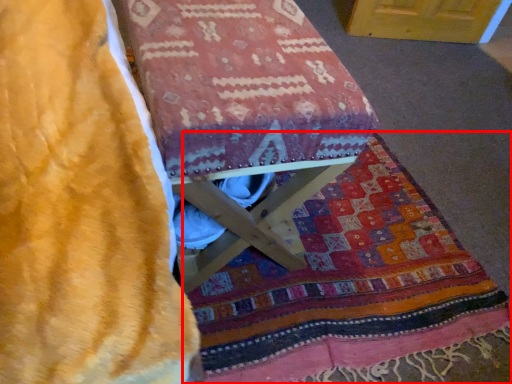
Question: From the image's perspective, where is blanket (annotated by the red box) located in relation to furniture in the image?

Choices:
 (A) below
 (B) above

Answer: (A)